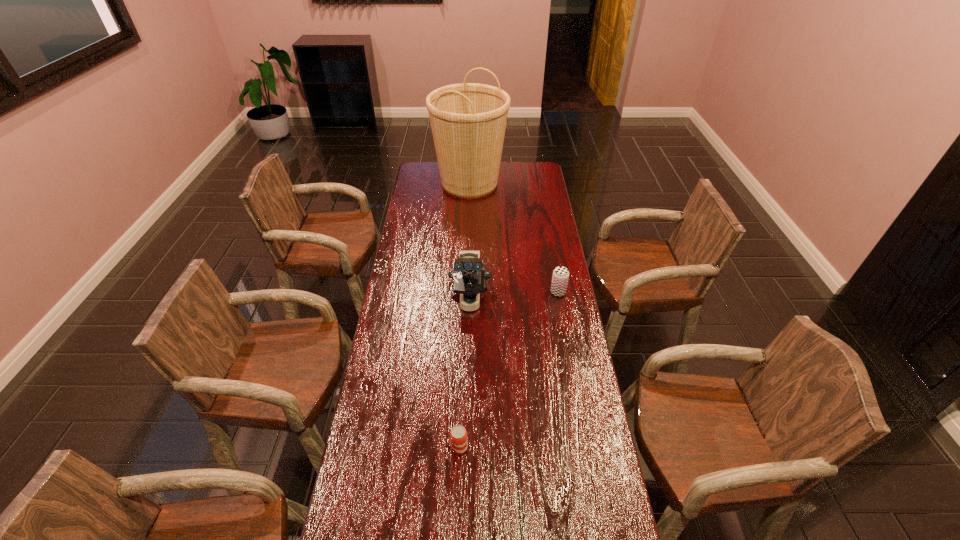
Locate which object is the second closest to the microscope. Please provide its 2D coordinates. Your answer should be formatted as a tuple, i.e. [(x, y)], where the tuple contains the x and y coordinates of a point satisfying the conditions above.

[(458, 435)]